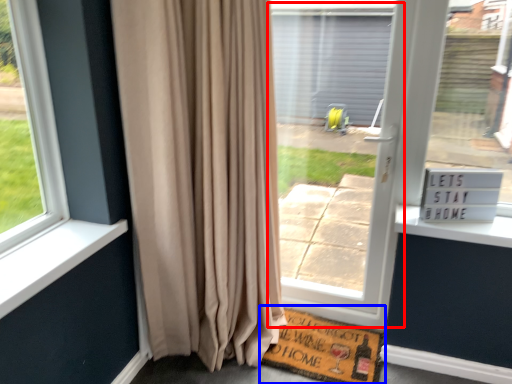
Question: Which of the following is the farthest to the observer, screen door (highlighted by a red box) or doormat (highlighted by a blue box)?

Choices:
 (A) screen door
 (B) doormat

Answer: (B)